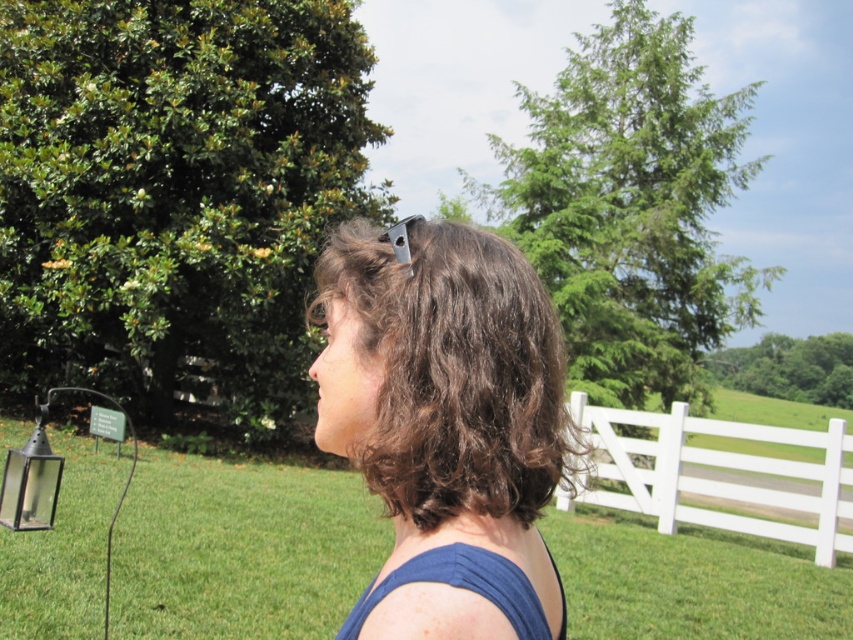
You are standing at the point with coordinates point (833, 356) and want to walk towards the point with coordinates point (36, 557). Which direction should you move in?

You should move forward because point (36, 557) is in front of point (833, 356).

You are standing in the grassy area and see two points marked in the scene. Which point is closer to you? The points are labeled as point 1 at coordinates point (36, 595) and point 2 at coordinates point (115, 508). Please answer based on their positions in the image.

Point 1 at coordinates point (36, 595) is closer to you because it is in front of point 2 at coordinates point (115, 508).

You are planning to place a new bench in the green grass at center. Considering the size of the black glass lantern at left, will there be enough space for the bench?

The green grass at center is bigger than the black glass lantern at left, so there should be enough space to place the bench in the green grass at center.